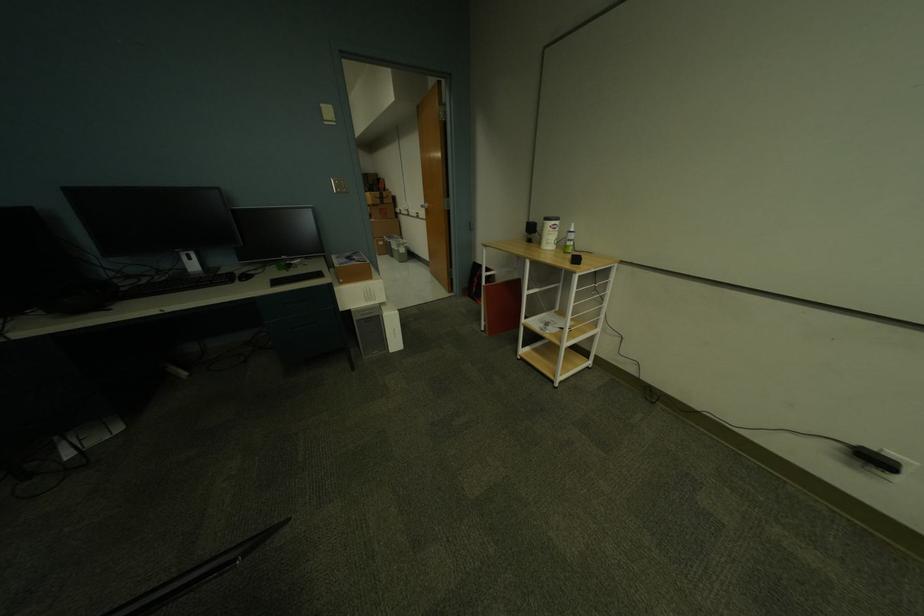
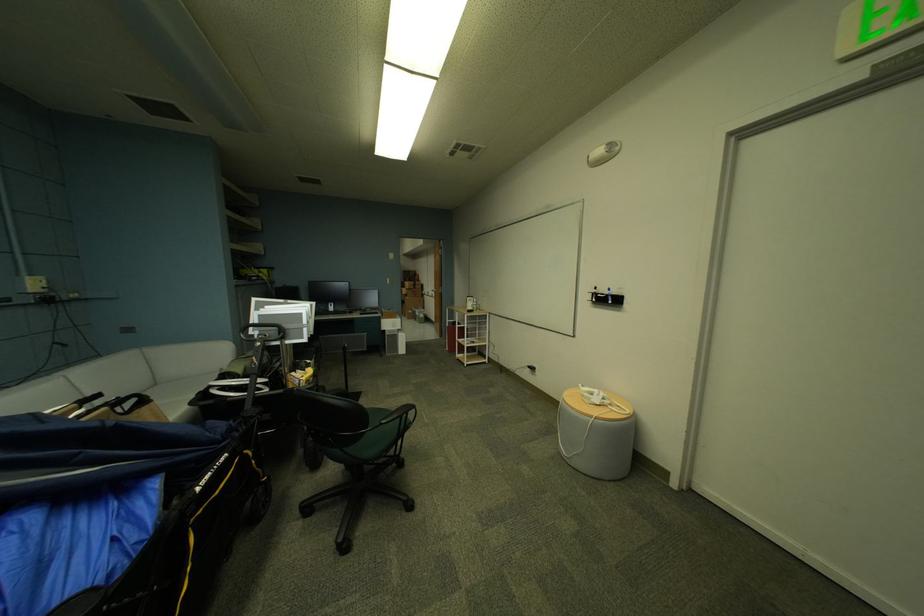
Locate, in the second image, the point that corresponds to point 386,195 in the first image.

(421, 284)